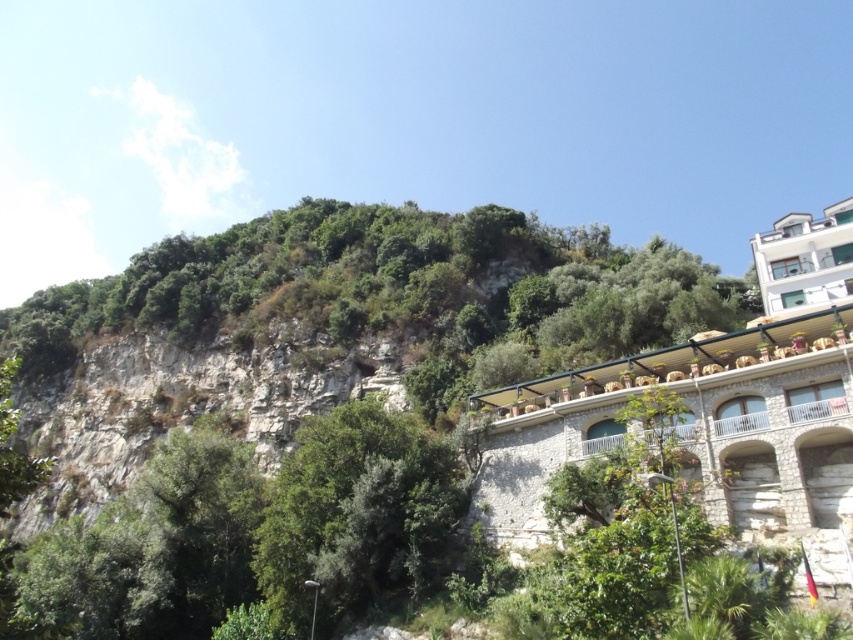
Who is taller, white stone building at center-right or white stone balcony at center?

white stone building at center-right is taller.

Identify the location of white stone building at center-right. (697, 432).

This screenshot has width=853, height=640. In order to click on white stone building at center-right in this screenshot , I will do `click(697, 432)`.

Can you confirm if green leafy tree at center is smaller than white stone balcony at center?

Incorrect, green leafy tree at center is not smaller in size than white stone balcony at center.

Does green leafy tree at center appear on the right side of white stone balcony at center?

Incorrect, green leafy tree at center is not on the right side of white stone balcony at center.

You are a GUI agent. You are given a task and a screenshot of the screen. Output one action in this format:
    pyautogui.click(x=<x>, y=<y>)
    Task: Click on the green leafy tree at center
    This screenshot has height=640, width=853.
    Given the screenshot: What is the action you would take?
    pyautogui.click(x=357, y=513)

Does green leafy tree at upper center have a larger size compared to white stone building at center-right?

Indeed, green leafy tree at upper center has a larger size compared to white stone building at center-right.

You are a GUI agent. You are given a task and a screenshot of the screen. Output one action in this format:
    pyautogui.click(x=<x>, y=<y>)
    Task: Click on the green leafy tree at upper center
    The image size is (853, 640).
    Given the screenshot: What is the action you would take?
    pyautogui.click(x=329, y=416)

Find the location of a particular element. This screenshot has width=853, height=640. green leafy tree at upper center is located at coordinates click(x=329, y=416).